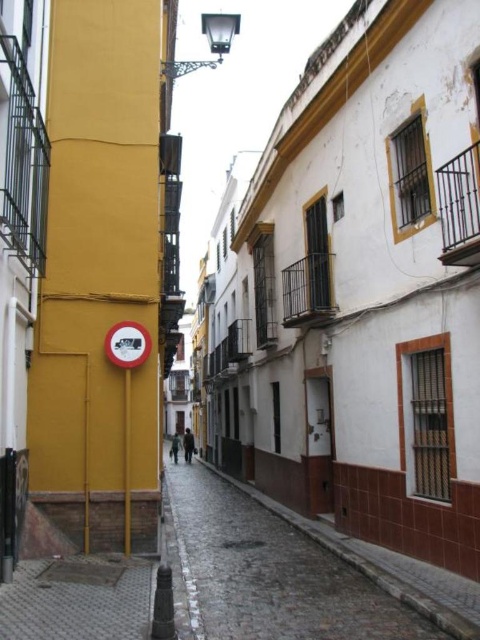
You are standing on the cobblestone street and want to walk towards the yellow building on the left. There are two points marked on the ground ahead of you. Which point, point (27, 561) or point (117, 339), is closer to you as you face the yellow building?

Point (27, 561) is closer to the viewer than point (117, 339), so the point closer to you as you face the yellow building is point (27, 561).

You are a delivery person trying to park your bike. You see the cobblestone pavement at center and the red plastic circle at center. Which object is positioned to the right side of the other?

The cobblestone pavement at center is to the right of the red plastic circle at center.

You are a delivery person trying to place a round package that is 1 meter in diameter on the cobblestone pavement at center. Can the red plastic circle at center fit inside the package?

The cobblestone pavement at center is wider than the red plastic circle at center, but the question is about the red plastic circle fitting inside the package. Since the red plastic circle at center is smaller than the cobblestone pavement at center, and the package is 1 meter in diameter, the red plastic circle at center can fit inside the package if its size is less than 1 meter. However, the exact size of the red plastic circle at center isn